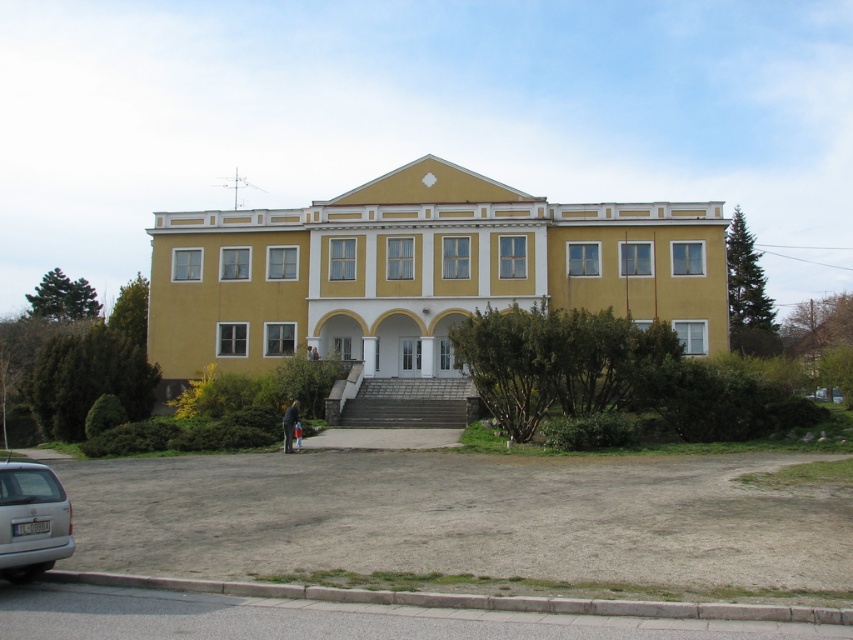
Question: Which point appears closest to the camera in this image?

Choices:
 (A) (32, 508)
 (B) (193, 264)

Answer: (A)

Question: Among these points, which one is nearest to the camera?

Choices:
 (A) (659, 211)
 (B) (48, 484)

Answer: (B)

Question: Can you confirm if yellow matte building at center is bigger than silver metallic van at lower left?

Choices:
 (A) yes
 (B) no

Answer: (A)

Question: Which point is farther from the camera taking this photo?

Choices:
 (A) (3, 464)
 (B) (280, 259)

Answer: (B)

Question: Is yellow matte building at center positioned at the back of silver metallic van at lower left?

Choices:
 (A) no
 (B) yes

Answer: (B)

Question: Is yellow matte building at center positioned in front of silver metallic van at lower left?

Choices:
 (A) no
 (B) yes

Answer: (A)